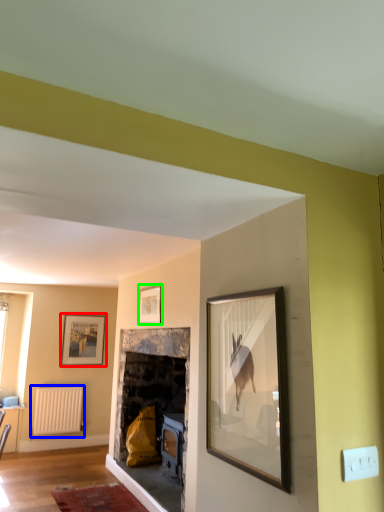
Question: Which object is positioned closest to picture frame (highlighted by a red box)? Select from radiator (highlighted by a blue box) and picture frame (highlighted by a green box).

Choices:
 (A) radiator
 (B) picture frame

Answer: (A)